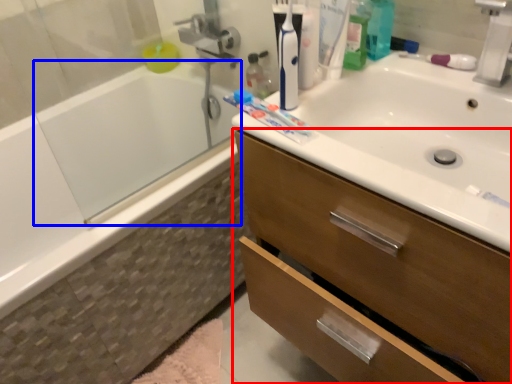
Question: Among these objects, which one is farthest to the camera, bathroom cabinet (highlighted by a red box) or bath (highlighted by a blue box)?

Choices:
 (A) bathroom cabinet
 (B) bath

Answer: (B)